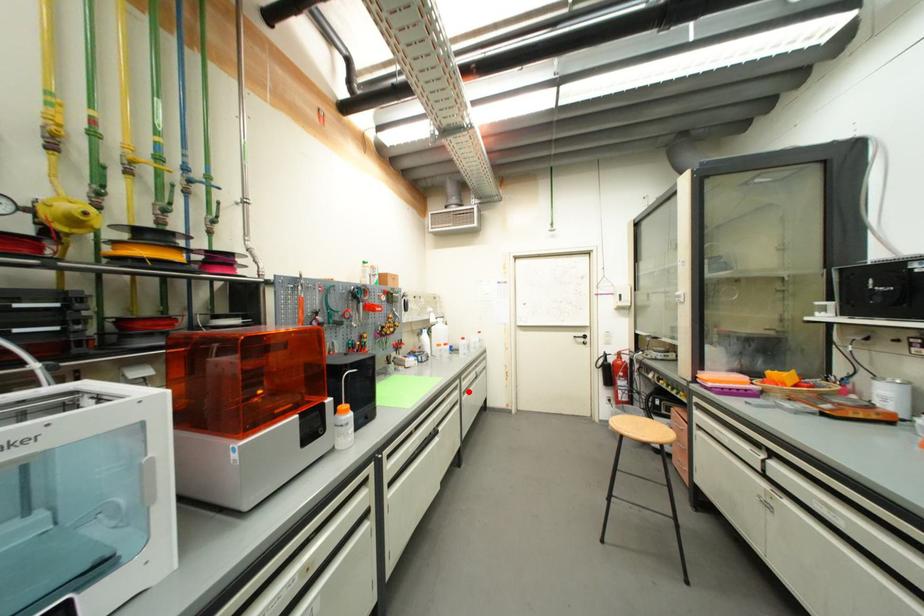
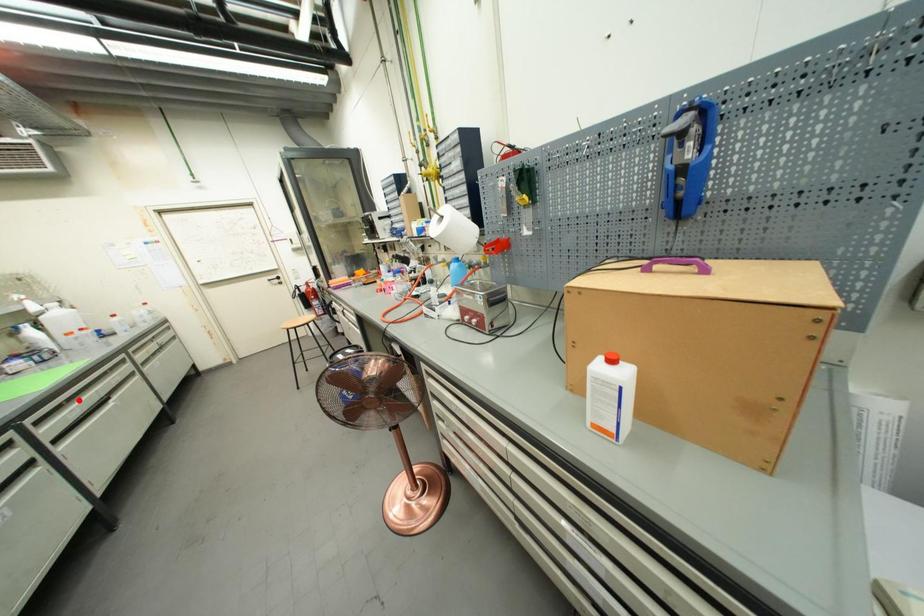
I am providing you with two images of the same scene from different viewpoints. A red point is marked on the first image and another point is marked on the second image. Is the red point in image1 aligned with the point shown in image2?

No